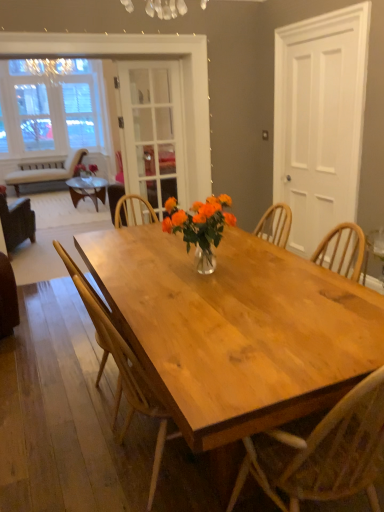
Question: Does brown leather chair at left, which is the 1th chair in back-to-front order, come in front of natural wood chair at center, the second chair from the right?

Choices:
 (A) yes
 (B) no

Answer: (B)

Question: Is brown leather chair at left, which ranks as the third chair in front-to-back order, thinner than natural wood chair at center, placed as the second chair when sorted from front to back?

Choices:
 (A) no
 (B) yes

Answer: (A)

Question: Considering the relative sizes of brown leather chair at left, which appears as the first chair when viewed from the left, and natural wood chair at center, the 2th chair from the back, in the image provided, is brown leather chair at left, which appears as the first chair when viewed from the left, taller than natural wood chair at center, the 2th chair from the back,?

Choices:
 (A) yes
 (B) no

Answer: (B)

Question: Does brown leather chair at left, the 3th chair when ordered from right to left, have a lesser height compared to natural wood chair at center, placed as the second chair when sorted from front to back?

Choices:
 (A) no
 (B) yes

Answer: (B)

Question: Is natural wood chair at center, placed as the second chair when sorted from front to back, a part of brown leather chair at left, the 3th chair when ordered from right to left?

Choices:
 (A) no
 (B) yes

Answer: (A)

Question: From the image's perspective, relative to brown leather chair at left, which is the 1th chair in back-to-front order, is natural wood chair at center, the 2th chair from the back, above or below?

Choices:
 (A) above
 (B) below

Answer: (B)

Question: Considering the positions of point (82, 288) and point (23, 236), is point (82, 288) closer or farther from the camera than point (23, 236)?

Choices:
 (A) farther
 (B) closer

Answer: (B)

Question: From a real-world perspective, is natural wood chair at center, the second chair from the right, physically located above or below brown leather chair at left, which is the 1th chair in back-to-front order?

Choices:
 (A) below
 (B) above

Answer: (B)

Question: Is natural wood chair at center, the 2th chair from the back, in front of or behind brown leather chair at left, which ranks as the third chair in front-to-back order, in the image?

Choices:
 (A) front
 (B) behind

Answer: (A)

Question: Considering the positions of brown leather chair at left, which appears as the first chair when viewed from the left, and translucent glass vase at center in the image, is brown leather chair at left, which appears as the first chair when viewed from the left, taller or shorter than translucent glass vase at center?

Choices:
 (A) short
 (B) tall

Answer: (B)

Question: From the image's perspective, relative to translucent glass vase at center, is brown leather chair at left, which ranks as the third chair in front-to-back order, above or below?

Choices:
 (A) below
 (B) above

Answer: (B)

Question: Is brown leather chair at left, which is the 1th chair in back-to-front order, spatially inside translucent glass vase at center, or outside of it?

Choices:
 (A) outside
 (B) inside

Answer: (A)

Question: Based on their sizes in the image, would you say brown leather chair at left, the 3th chair when ordered from right to left, is bigger or smaller than translucent glass vase at center?

Choices:
 (A) big
 (B) small

Answer: (A)

Question: From the image's perspective, relative to brown leather chair at left, which is the 1th chair in back-to-front order, is clear glass screen door at center, the 1th screen door viewed from the left, above or below?

Choices:
 (A) below
 (B) above

Answer: (B)

Question: Is point (137, 96) closer or farther from the camera than point (29, 206)?

Choices:
 (A) closer
 (B) farther

Answer: (A)